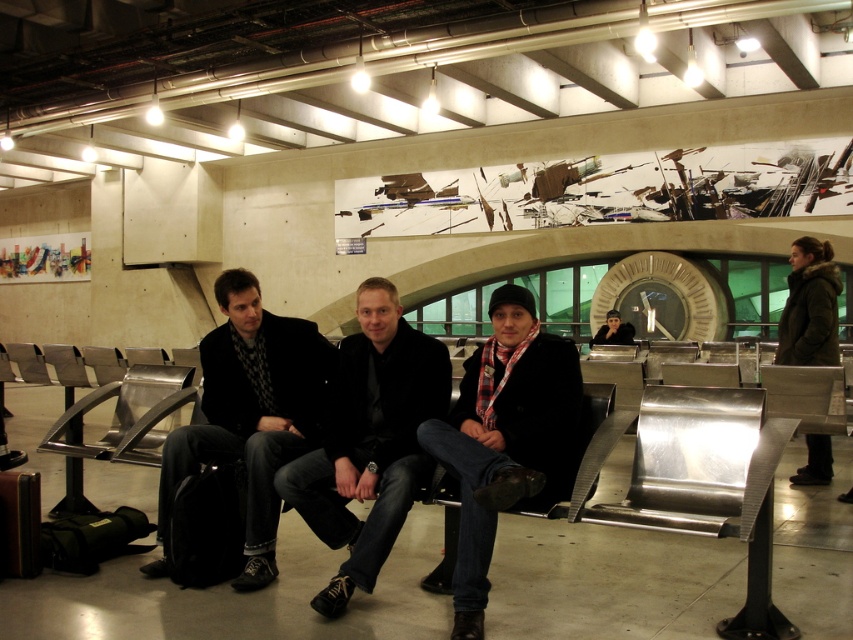
You are standing in the waiting area and want to hand a travel brochure to the person wearing the plaid scarf at center. If your arm can reach up to 1.8 meters, can you reach them without moving closer?

The plaid scarf at center is 2.63 meters away from the viewer. Since your arm can only reach up to 1.8 meters, you cannot reach the person wearing the plaid scarf at center without moving closer.

You are standing in the waiting area and want to locate two specific points marked in the image. The first point is at coordinates point (386, 342) and the second is at point (552, 392). Which point is closer to you?

Point (386, 342) is further to the camera than point (552, 392), so the second point is closer to you.